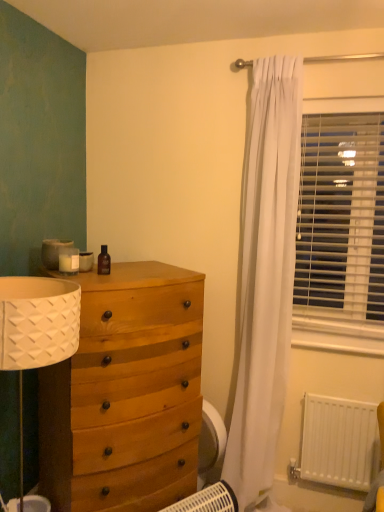
At what (x,y) coordinates should I click in order to perform the action: click on empty space that is ontop of wooden chest of drawers at left. Please return your answer as a coordinate pair (x, y). Looking at the image, I should click on (138, 271).